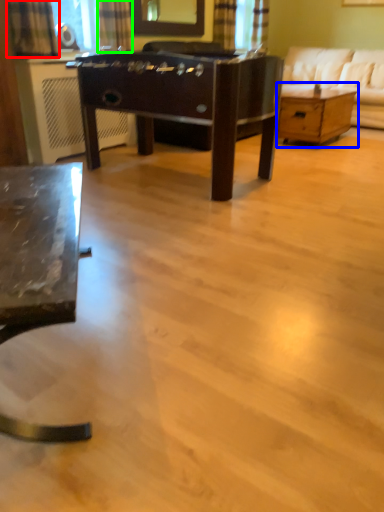
Question: Which object is positioned farthest from curtain (highlighted by a red box)? Select from table (highlighted by a blue box) and curtain (highlighted by a green box).

Choices:
 (A) table
 (B) curtain

Answer: (A)